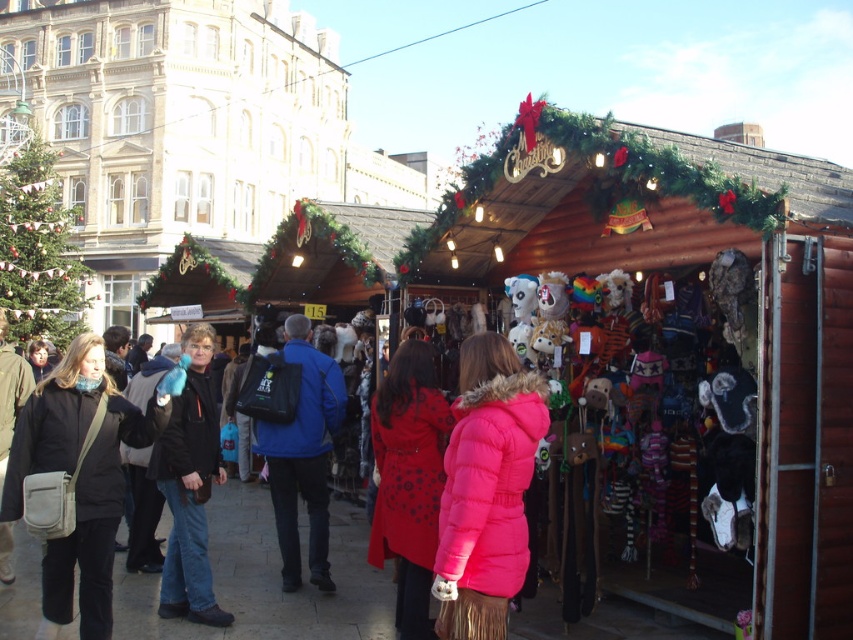
You are shopping at the market and see both the blue matte jacket at center and the matte black jacket at left. Which jacket is positioned higher relative to the other?

The blue matte jacket at center is located above the matte black jacket at left, so it is positioned higher.